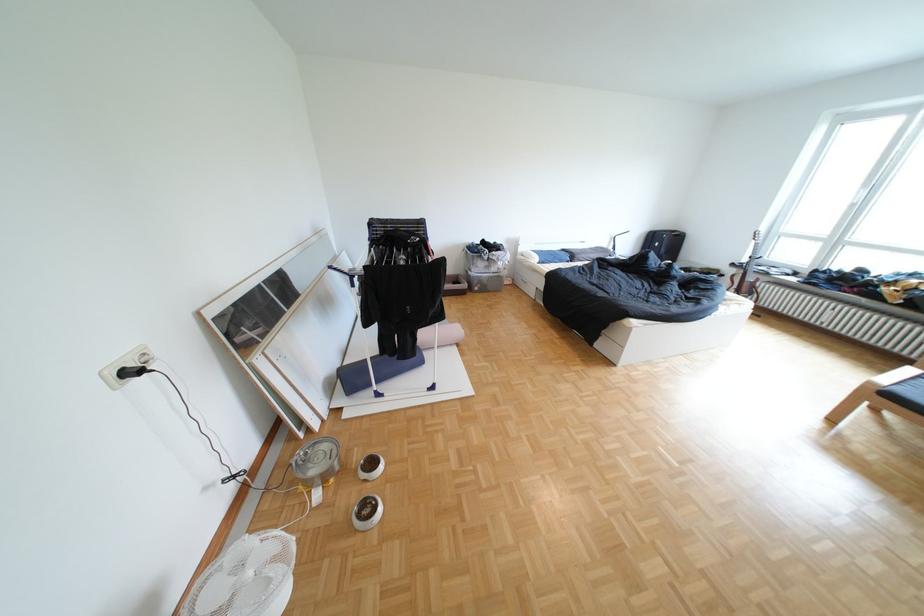
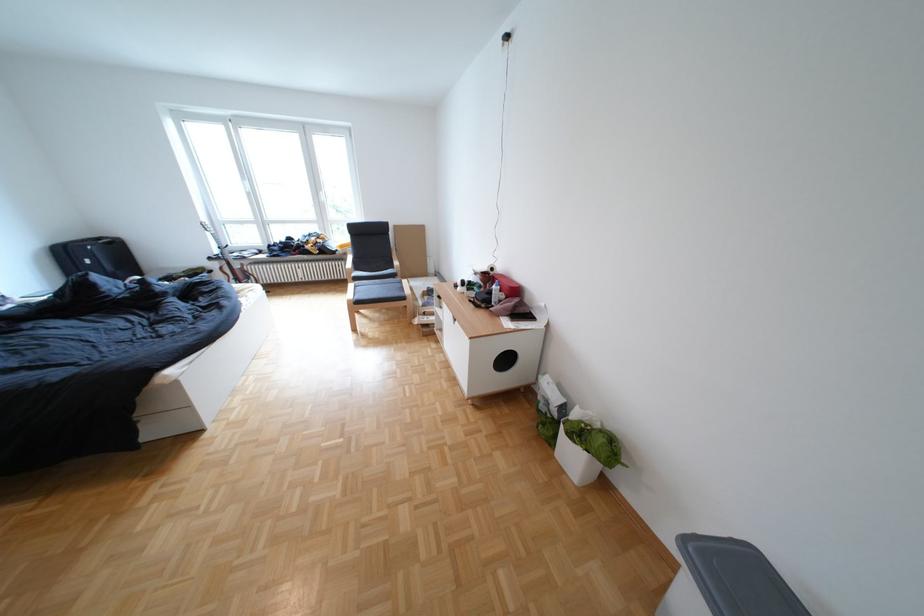
Question: I am providing you with two images of the same scene from different viewpoints. After the viewpoint changes to image2, which objects are now occluded?

Choices:
 (A) grey bin lid
 (B) chair sitting surface
 (C) white window handle
 (D) none of these

Answer: (D)